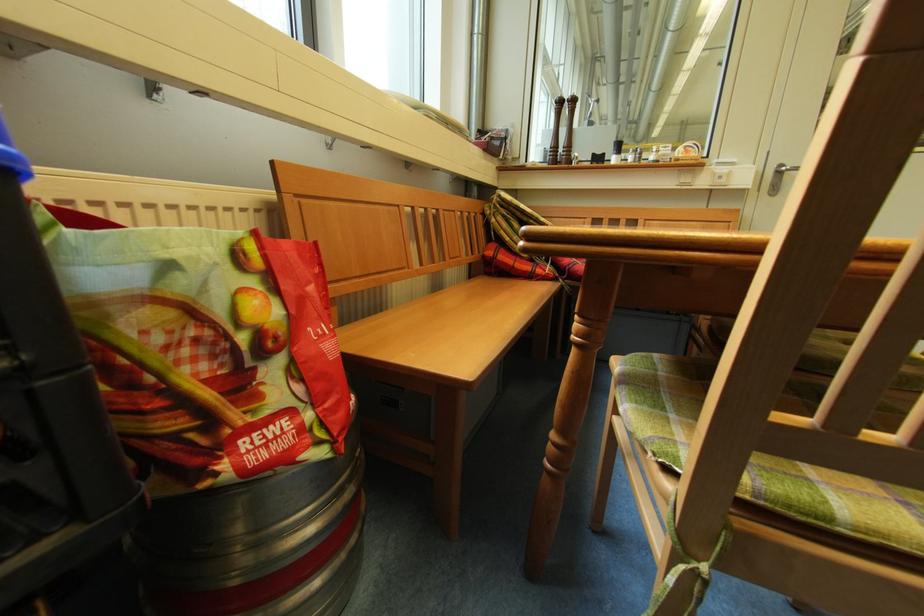
Describe the element at coordinates (784, 169) in the screenshot. I see `a silver door handle` at that location.